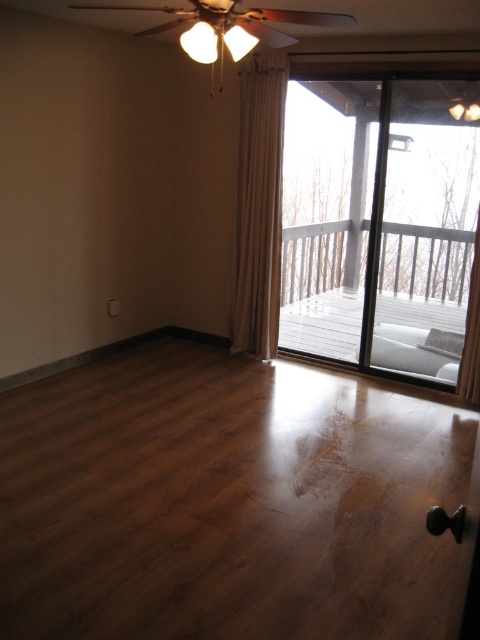
Can you confirm if wooden deck at center is positioned to the right of transparent glass door at center?

Incorrect, wooden deck at center is not on the right side of transparent glass door at center.

Who is lower down, wooden deck at center or transparent glass door at center?

Positioned lower is wooden deck at center.

Identify the location of wooden deck at center. The height and width of the screenshot is (640, 480). (228, 500).

The image size is (480, 640). Find the location of `wooden deck at center`. wooden deck at center is located at coordinates click(228, 500).

Between transparent glass door at center and beige fabric curtain at center, which one appears on the right side from the viewer's perspective?

transparent glass door at center

Is point (414, 186) farther from camera compared to point (245, 115)?

No, it is not.

Identify the location of transparent glass door at center. Image resolution: width=480 pixels, height=640 pixels. (382, 225).

Is transparent glass door at center shorter than white sheer curtain at right?

No.

Between point (404, 371) and point (470, 356), which one is positioned behind?

The point (404, 371) is behind.

Describe the element at coordinates (382, 225) in the screenshot. I see `transparent glass door at center` at that location.

Locate an element on the screen. This screenshot has width=480, height=640. transparent glass door at center is located at coordinates (382, 225).